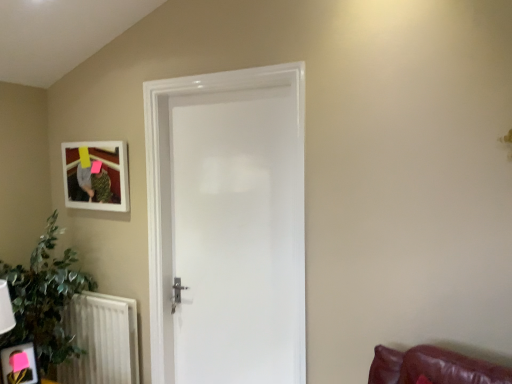
Question: From a real-world perspective, is white glossy door at center under white matte picture frame at upper left, placed as the first picture frame when sorted from top to bottom?

Choices:
 (A) yes
 (B) no

Answer: (A)

Question: Is white glossy door at center thinner than white matte picture frame at upper left, placed as the 2th picture frame when sorted from front to back?

Choices:
 (A) no
 (B) yes

Answer: (A)

Question: Would you consider white glossy door at center to be distant from white matte picture frame at upper left, which is counted as the second picture frame, starting from the bottom?

Choices:
 (A) no
 (B) yes

Answer: (A)

Question: Is white glossy door at center looking in the opposite direction of white matte picture frame at upper left, the first picture frame from the back?

Choices:
 (A) no
 (B) yes

Answer: (A)

Question: Considering the relative sizes of white glossy door at center and white matte picture frame at upper left, which is counted as the second picture frame, starting from the bottom, in the image provided, is white glossy door at center wider than white matte picture frame at upper left, which is counted as the second picture frame, starting from the bottom,?

Choices:
 (A) no
 (B) yes

Answer: (B)

Question: Is white glossy door at center bigger than white matte picture frame at upper left, placed as the 2th picture frame when sorted from front to back?

Choices:
 (A) yes
 (B) no

Answer: (A)

Question: Does white textured radiator at lower left have a larger size compared to matte black picture frame at lower left, acting as the second picture frame starting from the back?

Choices:
 (A) no
 (B) yes

Answer: (B)

Question: From a real-world perspective, is white textured radiator at lower left on top of matte black picture frame at lower left, which is counted as the first picture frame, starting from the bottom?

Choices:
 (A) yes
 (B) no

Answer: (B)

Question: Could matte black picture frame at lower left, acting as the second picture frame starting from the back, be considered to be inside white textured radiator at lower left?

Choices:
 (A) no
 (B) yes

Answer: (A)

Question: From a real-world perspective, is white textured radiator at lower left below matte black picture frame at lower left, which is the 2th picture frame in top-to-bottom order?

Choices:
 (A) no
 (B) yes

Answer: (B)

Question: Considering the relative positions of white textured radiator at lower left and matte black picture frame at lower left, which is counted as the first picture frame, starting from the bottom, in the image provided, is white textured radiator at lower left behind matte black picture frame at lower left, which is counted as the first picture frame, starting from the bottom,?

Choices:
 (A) yes
 (B) no

Answer: (A)

Question: From the image's perspective, is white textured radiator at lower left below matte black picture frame at lower left, positioned as the first picture frame in front-to-back order?

Choices:
 (A) no
 (B) yes

Answer: (B)

Question: Would you say matte black picture frame at lower left, positioned as the first picture frame in front-to-back order, is part of white matte picture frame at upper left, the first picture frame from the back,'s contents?

Choices:
 (A) no
 (B) yes

Answer: (A)